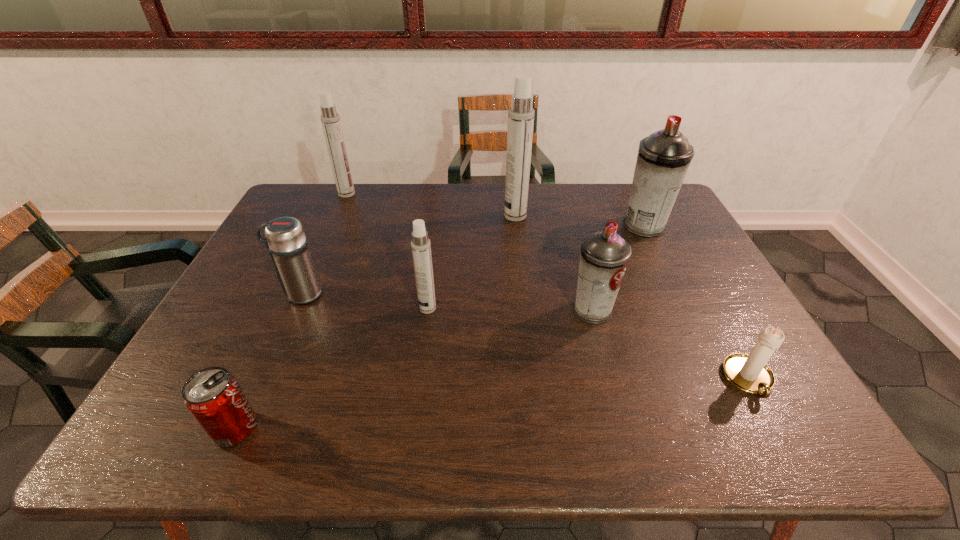
Locate an element on the screen. the third shortest object is located at coordinates (285, 239).

You are a GUI agent. You are given a task and a screenshot of the screen. Output one action in this format:
    pyautogui.click(x=<x>, y=<y>)
    Task: Click on the seventh farthest object
    This screenshot has width=960, height=540.
    Given the screenshot: What is the action you would take?
    coord(749,373)

The width and height of the screenshot is (960, 540). In order to click on white candle holder in this screenshot , I will do `click(749, 373)`.

Locate an element on the screen. red pop soda is located at coordinates (213, 396).

At what (x,y) coordinates should I click in order to perform the action: click on the nearest object. Please return your answer as a coordinate pair (x, y). The height and width of the screenshot is (540, 960). Looking at the image, I should click on (213, 396).

Where is `free space located 0.340m on the front of the rightmost white aerosol can`? The height and width of the screenshot is (540, 960). free space located 0.340m on the front of the rightmost white aerosol can is located at coordinates pos(523,292).

Identify the location of vacant space located 0.250m on the right of the leftmost white aerosol can. (424, 194).

I want to click on free region located 0.270m on the front of the bigger gray aerosol can, so click(x=681, y=300).

You are a GUI agent. You are given a task and a screenshot of the screen. Output one action in this format:
    pyautogui.click(x=<x>, y=<y>)
    Task: Click on the vacant region located 0.060m on the right of the second white aerosol can from left to right
    
    Given the screenshot: What is the action you would take?
    pyautogui.click(x=459, y=308)

Image resolution: width=960 pixels, height=540 pixels. In order to click on free location located on the left of the smaller gray aerosol can in this screenshot , I will do `click(440, 310)`.